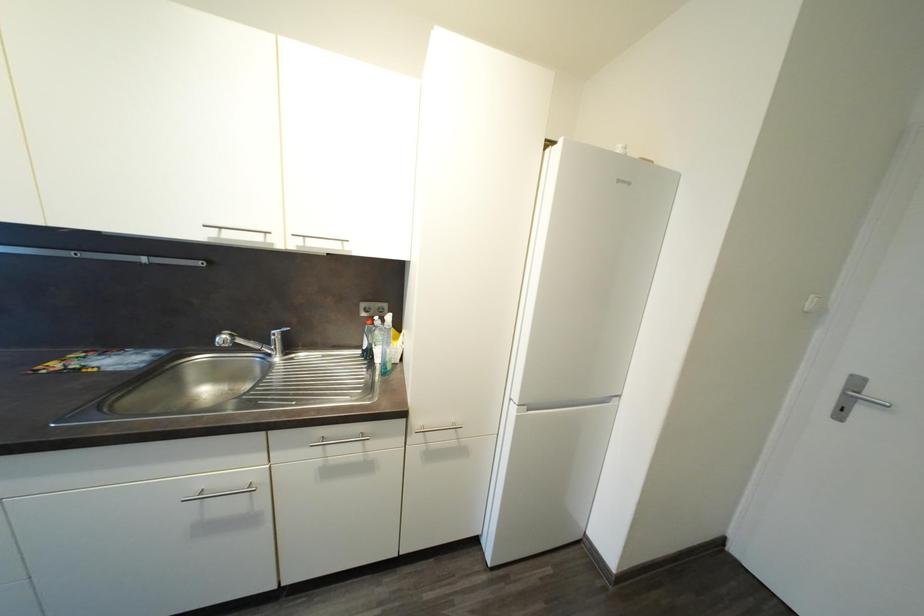
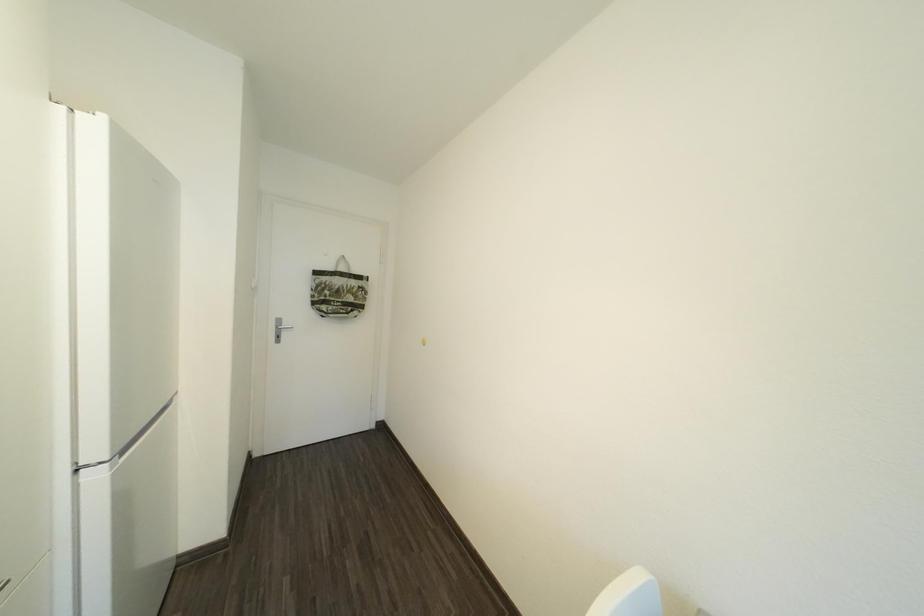
Question: The images are taken continuously from a first-person perspective. In which direction is your viewpoint rotating?

Choices:
 (A) Left
 (B) Right
 (C) Up
 (D) Down

Answer: (B)